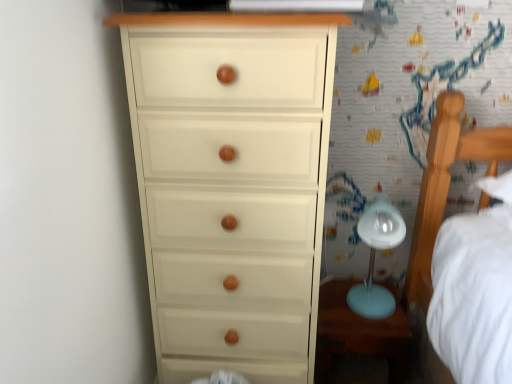
What do you see at coordinates (374, 257) in the screenshot? This screenshot has height=384, width=512. I see `light blue plastic table lamp at right` at bounding box center [374, 257].

Locate an element on the screen. matte white chest of drawers at left is located at coordinates (231, 185).

I want to click on light blue plastic table lamp at right, so click(x=374, y=257).

Is light blue plastic table lamp at right a part of matte blue table at lower right?

No.

Does matte blue table at lower right appear on the right side of light blue plastic table lamp at right?

In fact, matte blue table at lower right is to the left of light blue plastic table lamp at right.

Is matte blue table at lower right looking in the opposite direction of light blue plastic table lamp at right?

matte blue table at lower right is not turned away from light blue plastic table lamp at right.

Which object is further away from the camera taking this photo, matte blue table at lower right or light blue plastic table lamp at right?

matte blue table at lower right.

How far apart are light blue plastic table lamp at right and matte white chest of drawers at left?

A distance of 16.36 inches exists between light blue plastic table lamp at right and matte white chest of drawers at left.

Considering the sizes of objects light blue plastic table lamp at right and matte white chest of drawers at left in the image provided, who is wider, light blue plastic table lamp at right or matte white chest of drawers at left?

matte white chest of drawers at left.

Considering the relative sizes of light blue plastic table lamp at right and matte white chest of drawers at left in the image provided, is light blue plastic table lamp at right shorter than matte white chest of drawers at left?

Indeed, light blue plastic table lamp at right has a lesser height compared to matte white chest of drawers at left.

Which of these two, light blue plastic table lamp at right or matte white chest of drawers at left, is smaller?

Smaller between the two is light blue plastic table lamp at right.

Is matte white chest of drawers at left looking in the opposite direction of light blue plastic table lamp at right?

No.

Which of these two, matte white chest of drawers at left or light blue plastic table lamp at right, stands taller?

matte white chest of drawers at left.

Looking at this image, how much distance is there between matte white chest of drawers at left and light blue plastic table lamp at right?

matte white chest of drawers at left and light blue plastic table lamp at right are 41.55 centimeters apart.

Is matte white chest of drawers at left placed right next to light blue plastic table lamp at right?

There is a gap between matte white chest of drawers at left and light blue plastic table lamp at right.

In the scene shown: How many degrees apart are the facing directions of light blue plastic table lamp at right and matte blue table at lower right?

There is a 0.00474-degree angle between the facing directions of light blue plastic table lamp at right and matte blue table at lower right.

How much distance is there between light blue plastic table lamp at right and matte blue table at lower right?

A distance of 5.04 inches exists between light blue plastic table lamp at right and matte blue table at lower right.

In the scene shown: From a real-world perspective, does light blue plastic table lamp at right stand above matte blue table at lower right?

Yes, from a real-world perspective, light blue plastic table lamp at right is on top of matte blue table at lower right.

Which of these two, light blue plastic table lamp at right or matte blue table at lower right, is smaller?

With smaller size is light blue plastic table lamp at right.

From the image's perspective, is matte white chest of drawers at left beneath matte blue table at lower right?

No.

In the scene shown: Which point is more distant from viewer, (255, 342) or (402, 310)?

The point (402, 310) is farther.

From a real-world perspective, between matte white chest of drawers at left and matte blue table at lower right, who is vertically higher?

matte white chest of drawers at left, from a real-world perspective.

The image size is (512, 384). What are the coordinates of `the chest of drawers that appears in front of the matte blue table at lower right` in the screenshot? It's located at (231, 185).

Is matte blue table at lower right taller or shorter than matte white chest of drawers at left?

In the image, matte blue table at lower right appears to be shorter than matte white chest of drawers at left.

Considering the sizes of objects matte blue table at lower right and matte white chest of drawers at left in the image provided, who is thinner, matte blue table at lower right or matte white chest of drawers at left?

matte blue table at lower right.

Is matte blue table at lower right completely or partially outside of matte white chest of drawers at left?

Indeed, matte blue table at lower right is completely outside matte white chest of drawers at left.

Is matte blue table at lower right oriented away from matte white chest of drawers at left?

matte blue table at lower right is not turned away from matte white chest of drawers at left.

Where is `table located below the light blue plastic table lamp at right (from the image's perspective)`? table located below the light blue plastic table lamp at right (from the image's perspective) is located at coordinates (359, 334).

Image resolution: width=512 pixels, height=384 pixels. Identify the location of chest of drawers in front of the light blue plastic table lamp at right. (231, 185).

Looking at the image, which one is located further to matte white chest of drawers at left, light blue plastic table lamp at right or matte blue table at lower right?

light blue plastic table lamp at right.

From the image, which object appears to be nearer to light blue plastic table lamp at right, matte blue table at lower right or matte white chest of drawers at left?

matte blue table at lower right lies closer to light blue plastic table lamp at right than the other object.

Considering their positions, is matte white chest of drawers at left positioned closer to light blue plastic table lamp at right than matte blue table at lower right?

matte blue table at lower right lies closer to light blue plastic table lamp at right than the other object.

Estimate the real-world distances between objects in this image. Which object is closer to matte blue table at lower right, light blue plastic table lamp at right or matte white chest of drawers at left?

light blue plastic table lamp at right lies closer to matte blue table at lower right than the other object.

Considering their positions, is matte white chest of drawers at left positioned further to matte blue table at lower right than light blue plastic table lamp at right?

A: Based on the image, matte white chest of drawers at left appears to be further to matte blue table at lower right.

Considering their positions, is matte blue table at lower right positioned closer to matte white chest of drawers at left than light blue plastic table lamp at right?

The object closer to matte white chest of drawers at left is matte blue table at lower right.

The image size is (512, 384). In order to click on table lamp positioned between matte white chest of drawers at left and matte blue table at lower right from near to far in this screenshot , I will do `click(374, 257)`.